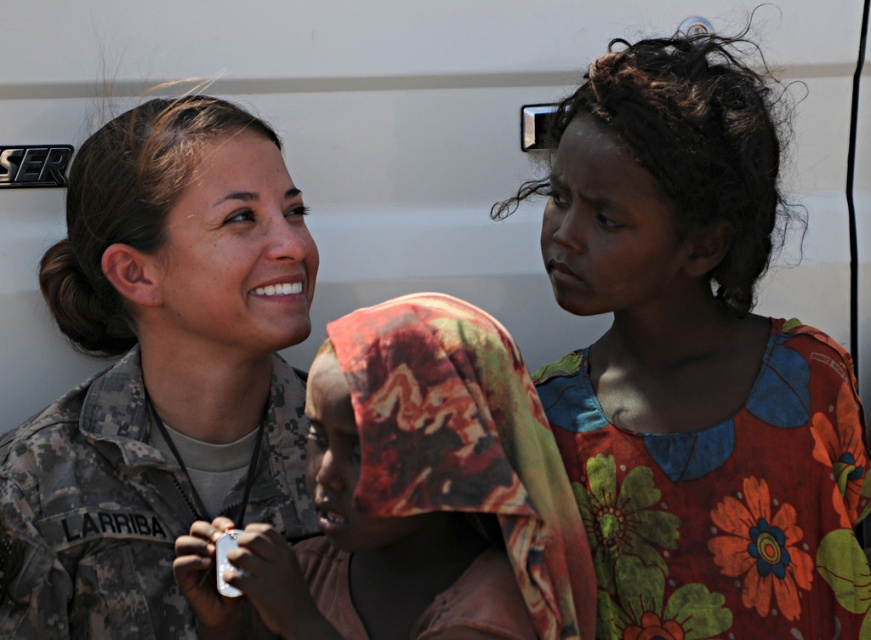
Question: Does floral fabric dress at center have a lesser width compared to camouflage uniform at center?

Choices:
 (A) yes
 (B) no

Answer: (B)

Question: Considering the real-world distances, which object is closest to the printed fabric headscarf at center?

Choices:
 (A) floral fabric dress at center
 (B) floral printed fabric at upper right
 (C) camouflage uniform at center

Answer: (A)

Question: Is floral fabric dress at center bigger than floral printed fabric at upper right?

Choices:
 (A) yes
 (B) no

Answer: (A)

Question: Does camouflage uniform at center have a larger size compared to floral printed fabric at upper right?

Choices:
 (A) yes
 (B) no

Answer: (A)

Question: Which point is farther from the camera taking this photo?

Choices:
 (A) (118, 509)
 (B) (495, 582)
 (C) (605, 554)
 (D) (724, 570)

Answer: (A)

Question: Estimate the real-world distances between objects in this image. Which object is farther from the camouflage uniform at center?

Choices:
 (A) floral fabric dress at center
 (B) printed fabric headscarf at center
 (C) floral printed fabric at upper right

Answer: (C)